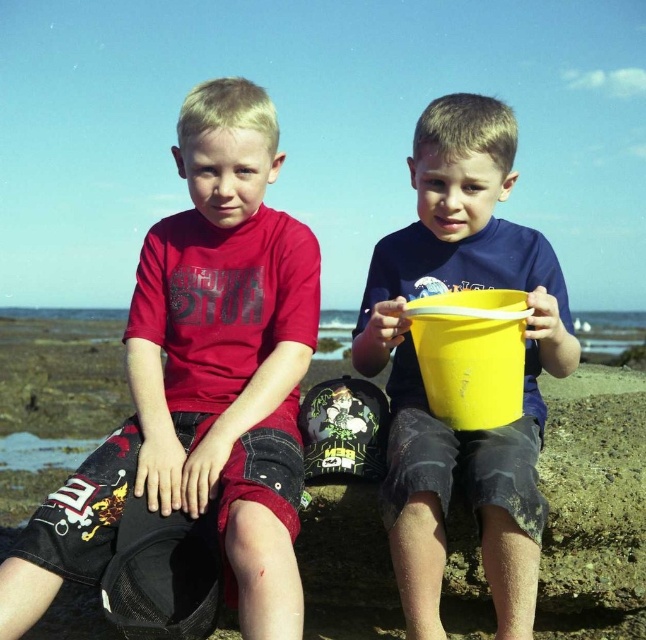
Question: In this image, where is matte red t-shirt at left located relative to yellow matte bucket at center?

Choices:
 (A) above
 (B) below

Answer: (A)

Question: Is matte red t-shirt at left smaller than yellow matte bucket at center?

Choices:
 (A) no
 (B) yes

Answer: (A)

Question: Does matte red t-shirt at left appear over yellow matte bucket at center?

Choices:
 (A) yes
 (B) no

Answer: (A)